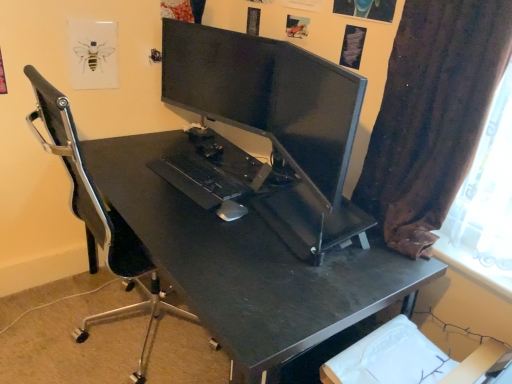
Question: Is black matte desk at center next to white matte mouse at center and touching it?

Choices:
 (A) yes
 (B) no

Answer: (B)

Question: Considering the relative positions of black matte desk at center and white matte mouse at center in the image provided, is black matte desk at center in front of white matte mouse at center?

Choices:
 (A) no
 (B) yes

Answer: (B)

Question: Is black matte desk at center facing towards white matte mouse at center?

Choices:
 (A) yes
 (B) no

Answer: (B)

Question: Can you confirm if black matte desk at center is bigger than white matte mouse at center?

Choices:
 (A) yes
 (B) no

Answer: (A)

Question: Does black matte desk at center have a lesser height compared to white matte mouse at center?

Choices:
 (A) no
 (B) yes

Answer: (A)

Question: Considering the positions of white matte mouse at center and brown fabric curtain at right in the image, is white matte mouse at center wider or thinner than brown fabric curtain at right?

Choices:
 (A) wide
 (B) thin

Answer: (B)

Question: Considering the positions of white matte mouse at center and brown fabric curtain at right in the image, is white matte mouse at center bigger or smaller than brown fabric curtain at right?

Choices:
 (A) big
 (B) small

Answer: (B)

Question: Would you say white matte mouse at center is to the left or to the right of brown fabric curtain at right in the picture?

Choices:
 (A) left
 (B) right

Answer: (A)

Question: From the image's perspective, is white matte mouse at center located above or below brown fabric curtain at right?

Choices:
 (A) above
 (B) below

Answer: (B)

Question: In terms of size, does brown fabric curtain at right appear bigger or smaller than black matte desk at center?

Choices:
 (A) small
 (B) big

Answer: (A)

Question: From a real-world perspective, is brown fabric curtain at right physically located above or below black matte desk at center?

Choices:
 (A) below
 (B) above

Answer: (B)

Question: In terms of height, does brown fabric curtain at right look taller or shorter compared to black matte desk at center?

Choices:
 (A) short
 (B) tall

Answer: (B)

Question: Is brown fabric curtain at right inside or outside of black matte desk at center?

Choices:
 (A) inside
 (B) outside

Answer: (B)

Question: Visually, is black matte desk at center positioned to the left or to the right of brown fabric curtain at right?

Choices:
 (A) right
 (B) left

Answer: (B)

Question: From a real-world perspective, is black matte desk at center physically located above or below brown fabric curtain at right?

Choices:
 (A) below
 (B) above

Answer: (A)